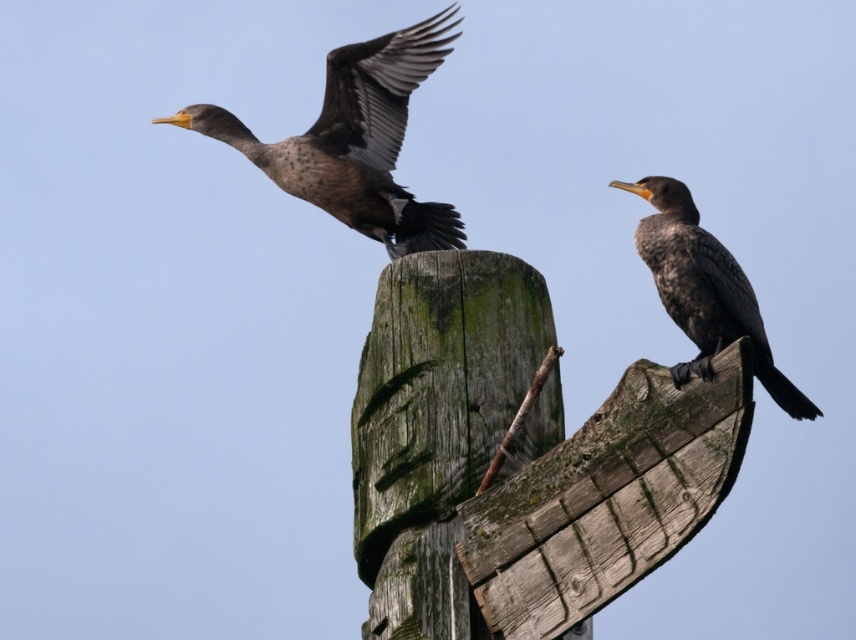
You are a birdwatcher trying to observe the two cormorants in the scene. The first cormorant has brown speckled feathers at upper left and the second has dark brown feathers at center. If you have a telescope with a 50 meter range, can you see both cormorants clearly through it?

The brown speckled feathers at upper left and dark brown feathers at center are 37.48 meters apart from each other. Since the telescope has a 50 meter range, you can see both cormorants clearly through it as the distance between them is within the telescope range.

You are standing 100 meters away from a wooden structure where two cormorants are perched. One cormorant is flying near a point marked at coordinates [346,136]. Is the cormorant closer to you or farther than the wooden structure?

The point at coordinates [346,136] is 116.07 meters away from the viewer. Since the wooden structure is where the cormorants are perched, the structure itself must be at that distance. Therefore, the cormorant flying near that point is at the same distance as the structure, so it is neither closer nor farther.